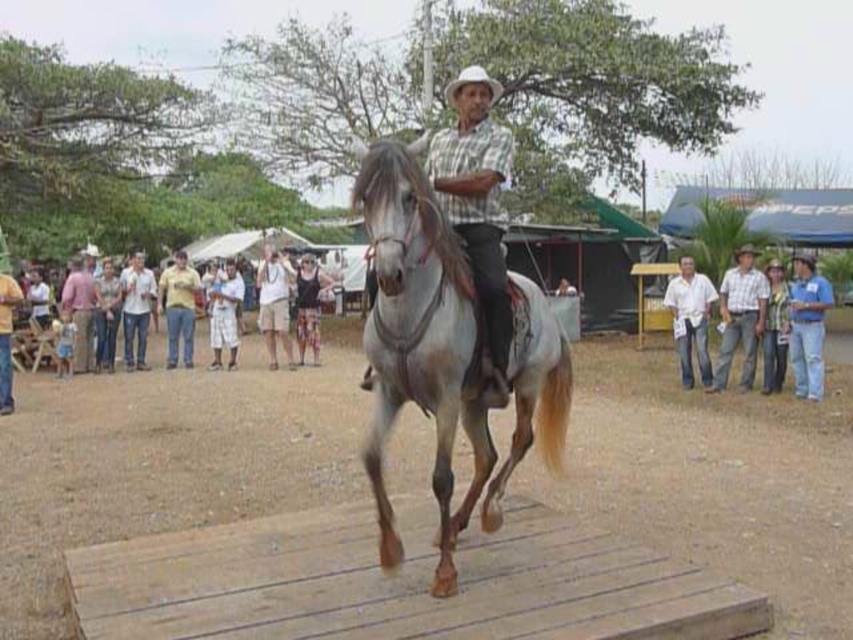
You are standing at the fair and see two points in the scene. The first point is at coordinates point (386,211) and the second is at point (804,273). Which point is closer to you?

Point (386,211) is closer to the viewer than point (804,273).

You are a photographer at the fair and want to take a photo of the white glossy horse at center and the white cotton shirt at right. Can you capture both subjects in the same frame without moving the camera?

Yes, because the white glossy horse at center is in front of the white cotton shirt at right, so both can be seen in the same frame without moving the camera.

You are standing at the point marked as point [164,461]. What is the object located at this point in the scene?

The point [164,461] corresponds to the brown wooden dirt track at center.